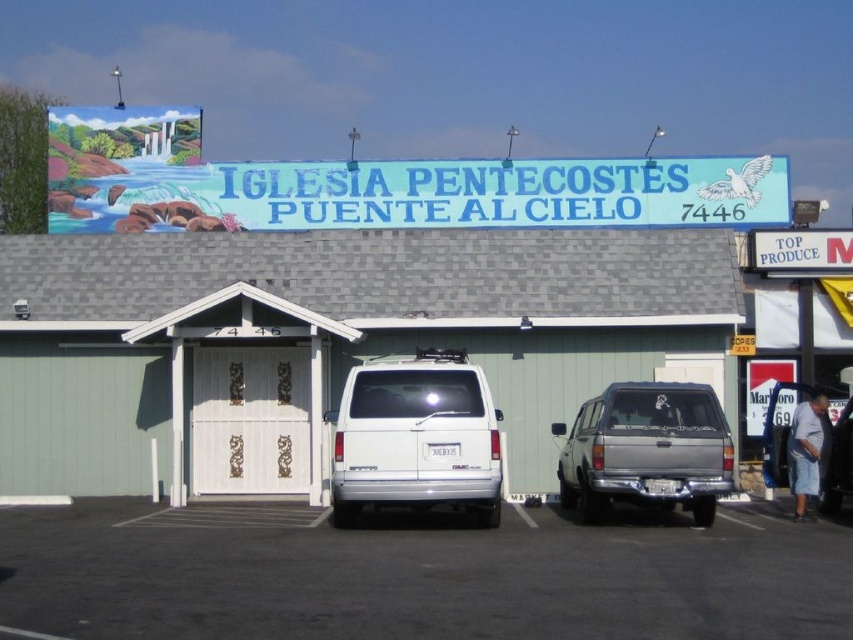
You are a delivery driver who needs to park your truck in the black asphalt parking lot at center. The white plastic sign at upper right is blocking your view of the entrance. Can you still see the entrance while driving into the parking lot?

The black asphalt parking lot at center is larger in size than the white plastic sign at upper right, so the sign is not large enough to block your view of the entrance while driving into the parking lot. You should still be able to see the entrance.

You are standing in front of the building and want to park your car in the parking lot. The parking lot has a designated parking spot at point 0.705, 0.760. Can you determine if the silver metallic van at center is already occupying that spot?

The silver metallic van at center is located at point (647, 451), so yes, the silver metallic van at center is occupying the designated parking spot at that location.